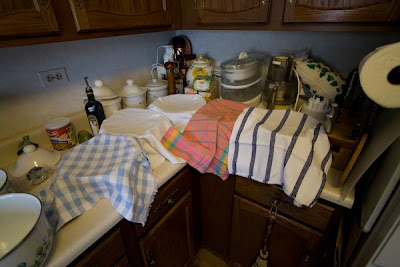
At what (x,y) coordinates should I click in order to perform the action: click on food processor. Please return your answer as a coordinate pair (x, y). The height and width of the screenshot is (267, 400). Looking at the image, I should click on (245, 83).